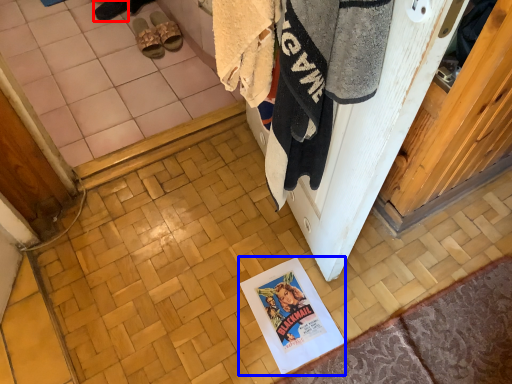
Question: Which object is further to the camera taking this photo, footwear (highlighted by a red box) or poster page (highlighted by a blue box)?

Choices:
 (A) footwear
 (B) poster page

Answer: (A)